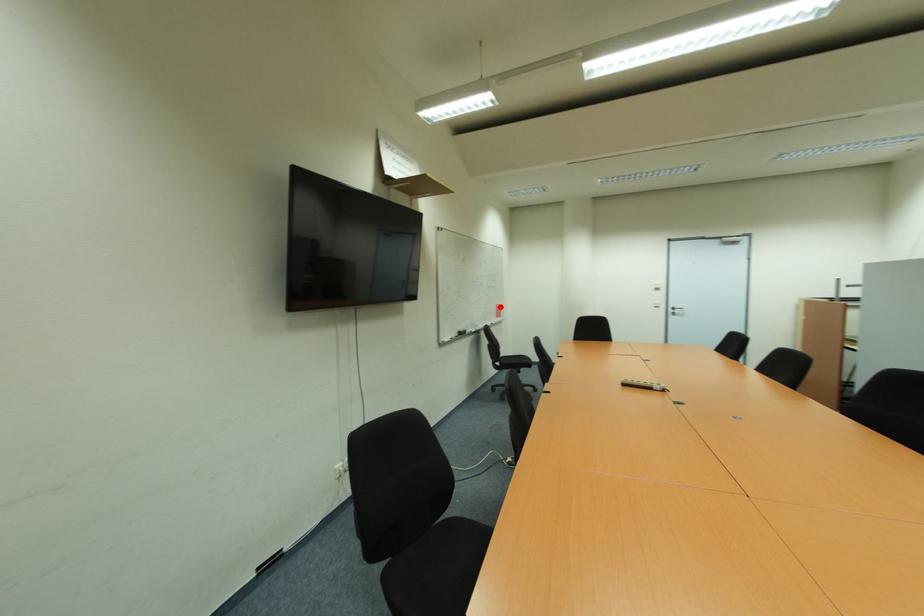
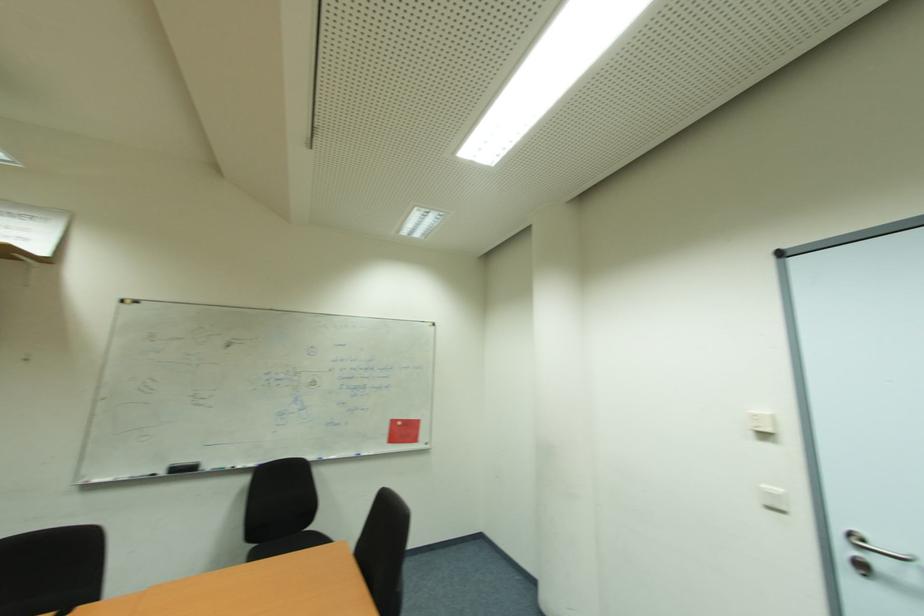
Find the pixel in the second image that matches the highlighted location in the first image.

(397, 423)